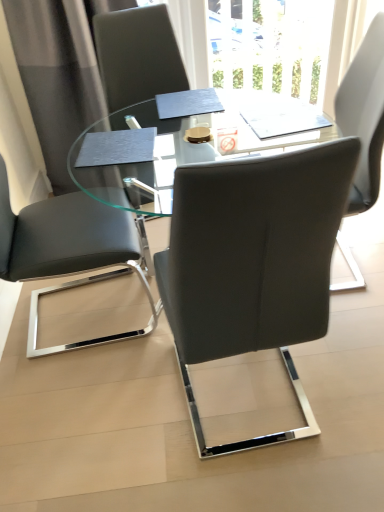
Question: From the image's perspective, is transparent glass table at center located beneath gray fabric curtain at upper left?

Choices:
 (A) no
 (B) yes

Answer: (B)

Question: From a real-world perspective, is transparent glass table at center physically below gray fabric curtain at upper left?

Choices:
 (A) yes
 (B) no

Answer: (A)

Question: Is transparent glass table at center to the left of gray fabric curtain at upper left from the viewer's perspective?

Choices:
 (A) yes
 (B) no

Answer: (B)

Question: From a real-world perspective, is transparent glass table at center positioned over gray fabric curtain at upper left based on gravity?

Choices:
 (A) yes
 (B) no

Answer: (B)

Question: Is transparent glass table at center to the right of gray fabric curtain at upper left from the viewer's perspective?

Choices:
 (A) no
 (B) yes

Answer: (B)

Question: Can you confirm if transparent glass table at center is taller than gray fabric curtain at upper left?

Choices:
 (A) yes
 (B) no

Answer: (B)

Question: Considering the relative sizes of matte gray chair at center, which is the 1th chair from right to left, and matte black chair at left, acting as the 2th chair starting from the right, in the image provided, is matte gray chair at center, which is the 1th chair from right to left, wider than matte black chair at left, acting as the 2th chair starting from the right,?

Choices:
 (A) no
 (B) yes

Answer: (A)

Question: Can you confirm if matte gray chair at center, which is the second chair in left-to-right order, is taller than matte black chair at left, acting as the 2th chair starting from the right?

Choices:
 (A) yes
 (B) no

Answer: (A)

Question: From the image's perspective, is matte gray chair at center, which is the second chair in left-to-right order, beneath matte black chair at left, the 1th chair when ordered from left to right?

Choices:
 (A) no
 (B) yes

Answer: (B)

Question: Can you confirm if matte gray chair at center, which is the 1th chair from right to left, is shorter than matte black chair at left, acting as the 2th chair starting from the right?

Choices:
 (A) no
 (B) yes

Answer: (A)

Question: Is matte gray chair at center, which is the second chair in left-to-right order, at the right side of matte black chair at left, acting as the 2th chair starting from the right?

Choices:
 (A) yes
 (B) no

Answer: (A)

Question: Is matte gray chair at center, which is the 1th chair from right to left, bigger than matte black chair at left, acting as the 2th chair starting from the right?

Choices:
 (A) yes
 (B) no

Answer: (B)

Question: Does transparent glass table at center have a lesser width compared to matte black chair at left, acting as the 2th chair starting from the right?

Choices:
 (A) yes
 (B) no

Answer: (B)